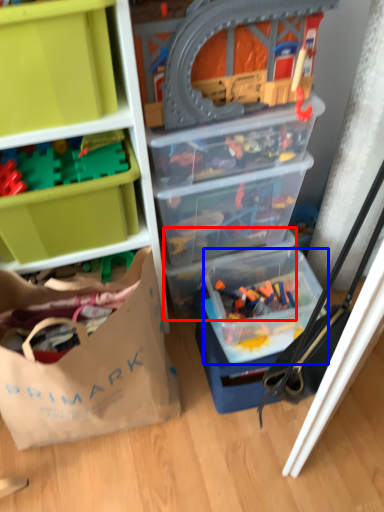
Question: Which point is closer to the camera, storage box (highlighted by a red box) or storage box (highlighted by a blue box)?

Choices:
 (A) storage box
 (B) storage box

Answer: (B)